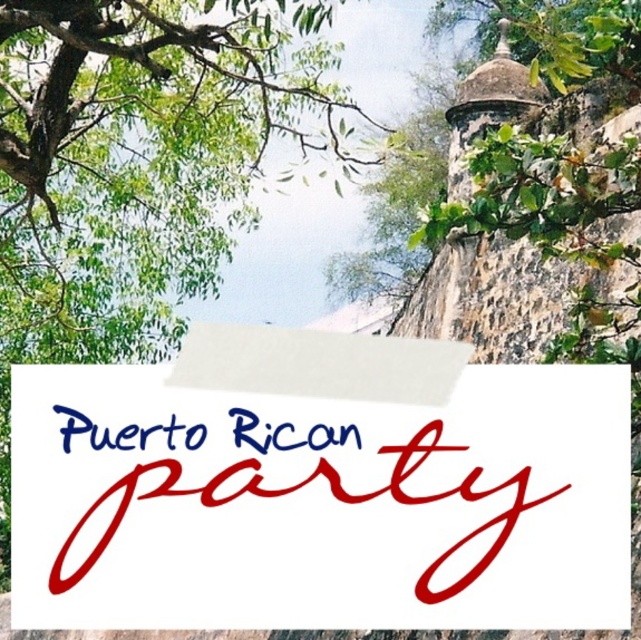
In the scene shown: You are designing a poster and want to ensure the blue ink text at center is clearly visible. Given the green leafy tree at upper left is covering part of it, how can you adjust the layout to improve visibility?

Since the green leafy tree at upper left is positioned over the blue ink text at center, moving the text to an uncovered area or resizing the tree image would help ensure the text remains visible.

You are at a Puerto Rican party and want to read the text on the white paper sign at center. However, the green leafy tree at upper left is blocking your view. Can you move to a different position where you can see both the sign and the tree simultaneously?

The white paper sign at center is positioned under the green leafy tree at upper left. To see both, move to a position where you are not directly under the tree, perhaps to the side or behind the sign so that the tree is above or behind the sign in your line of sight.